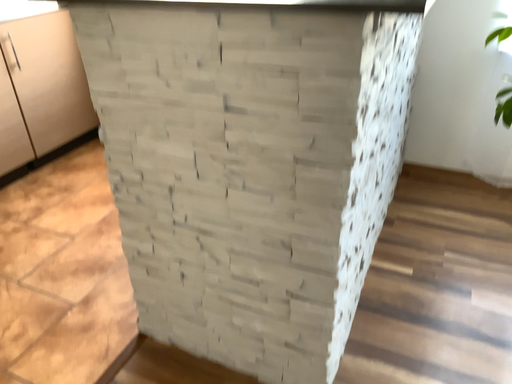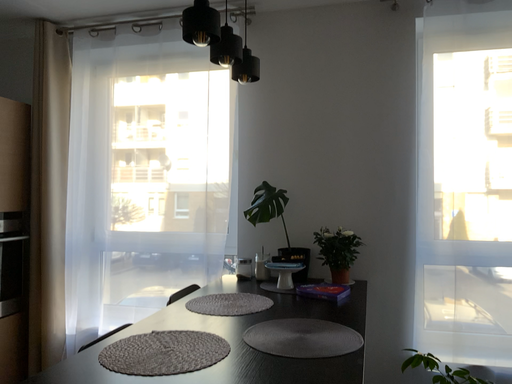
Question: How did the camera likely rotate when shooting the video?

Choices:
 (A) rotated left
 (B) rotated right

Answer: (B)